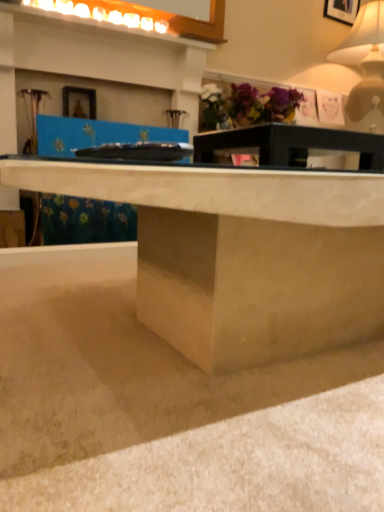
I want to click on free point above smooth concrete at lower center (from a real-world perspective), so click(x=117, y=329).